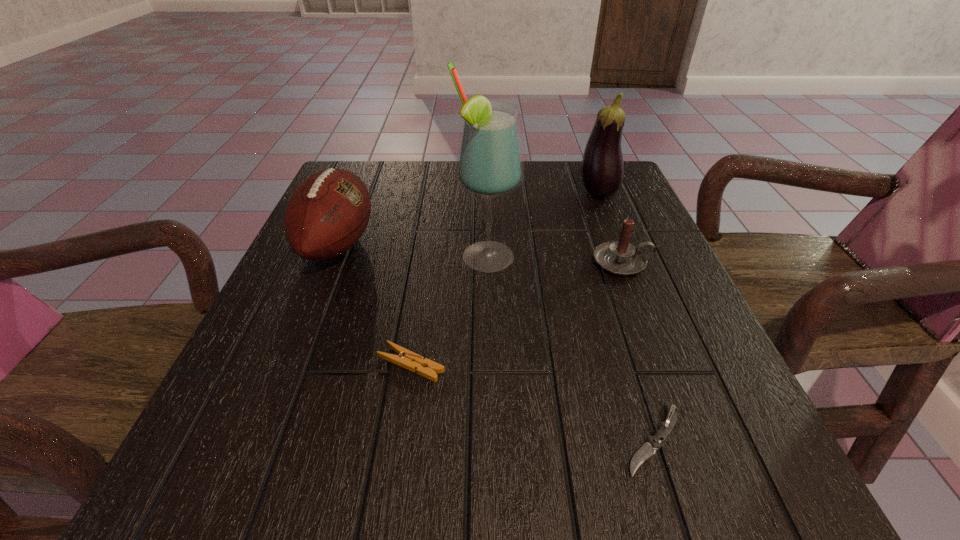
Where is `free space between the farthest object and the tallest object`? Image resolution: width=960 pixels, height=540 pixels. free space between the farthest object and the tallest object is located at coordinates (542, 226).

Find the location of `free space between the fifth object from right to left and the tallest object`. free space between the fifth object from right to left and the tallest object is located at coordinates (449, 311).

What are the coordinates of `free space between the third tallest object and the tallest object` in the screenshot? It's located at (412, 251).

The height and width of the screenshot is (540, 960). I want to click on unoccupied position between the leftmost object and the eggplant, so click(x=468, y=219).

At what (x,y) coordinates should I click in order to perform the action: click on unoccupied position between the nearest object and the candle. Please return your answer as a coordinate pair (x, y). Looking at the image, I should click on (637, 350).

I want to click on free point between the alcohol and the candle, so click(555, 260).

Locate an element on the screen. vacant region between the third object from left to right and the leftmost object is located at coordinates (412, 251).

Where is `free space that is in between the shortest object and the eggplant`? This screenshot has width=960, height=540. free space that is in between the shortest object and the eggplant is located at coordinates (626, 316).

Find the location of a particular element. vacant area that lies between the third tallest object and the tallest object is located at coordinates (412, 251).

At what (x,y) coordinates should I click in order to perform the action: click on the third closest object relative to the third shortest object. Please return your answer as a coordinate pair (x, y). Image resolution: width=960 pixels, height=540 pixels. Looking at the image, I should click on (648, 449).